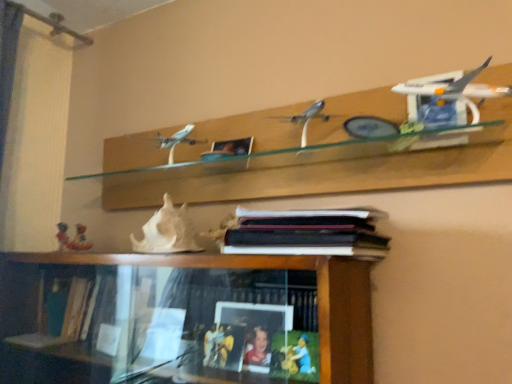
Question: Choose the correct answer: Is white matte seashell at center, the 1th toy in the front-to-back sequence, inside hardcover book at center or outside it?

Choices:
 (A) inside
 (B) outside

Answer: (B)

Question: Considering the positions of white matte seashell at center, which ranks as the second toy in left-to-right order, and hardcover book at center in the image, is white matte seashell at center, which ranks as the second toy in left-to-right order, wider or thinner than hardcover book at center?

Choices:
 (A) wide
 (B) thin

Answer: (B)

Question: Which object is the farthest from the matte plastic toy at lower left, the second toy from the front?

Choices:
 (A) hardcover book at center
 (B) white matte seashell at center, which ranks as the second toy in left-to-right order
 (C) white glossy airplane at upper right

Answer: (C)

Question: Estimate the real-world distances between objects in this image. Which object is closer to the matte plastic toy at lower left, marked as the 2th toy in a right-to-left arrangement?

Choices:
 (A) hardcover book at center
 (B) white matte seashell at center, the 1th toy in the front-to-back sequence
 (C) white glossy airplane at upper right

Answer: (B)